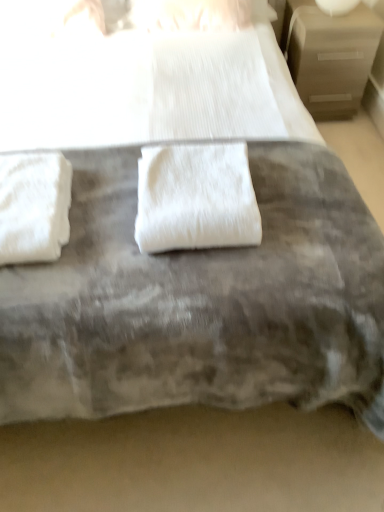
Question: Is white fluffy towel at center, which is counted as the first towel, starting from the right, thinner than white fluffy towel at left, which is the second towel from right to left?

Choices:
 (A) yes
 (B) no

Answer: (A)

Question: Is white fluffy towel at center, which is counted as the first towel, starting from the right, placed right next to white fluffy towel at left, which is the first towel from left to right?

Choices:
 (A) no
 (B) yes

Answer: (A)

Question: Does white fluffy towel at center, which is counted as the first towel, starting from the right, have a greater width compared to white fluffy towel at left, which is the second towel from right to left?

Choices:
 (A) no
 (B) yes

Answer: (A)

Question: From a real-world perspective, is white fluffy towel at center, which is counted as the first towel, starting from the right, under white fluffy towel at left, which is the first towel from left to right?

Choices:
 (A) yes
 (B) no

Answer: (B)

Question: Can you confirm if white fluffy towel at center, which ranks as the second towel in left-to-right order, is shorter than white fluffy towel at left, which is the first towel from left to right?

Choices:
 (A) yes
 (B) no

Answer: (A)

Question: In terms of size, does white fluffy towel at center, which ranks as the second towel in left-to-right order, appear bigger or smaller than white fluffy towel at left, which is the first towel from left to right?

Choices:
 (A) small
 (B) big

Answer: (B)

Question: Is white fluffy towel at center, which ranks as the second towel in left-to-right order, in front of or behind white fluffy towel at left, which is the first towel from left to right, in the image?

Choices:
 (A) behind
 (B) front

Answer: (A)

Question: Do you think white fluffy towel at center, which ranks as the second towel in left-to-right order, is within white fluffy towel at left, which is the first towel from left to right, or outside of it?

Choices:
 (A) inside
 (B) outside

Answer: (B)

Question: Based on their positions, is white fluffy towel at center, which ranks as the second towel in left-to-right order, located to the left or right of white fluffy towel at left, which is the first towel from left to right?

Choices:
 (A) left
 (B) right

Answer: (B)

Question: Which is correct: white glossy table lamp at upper right is inside white fluffy towel at left, which is the second towel from right to left, or outside of it?

Choices:
 (A) outside
 (B) inside

Answer: (A)

Question: Considering the positions of white glossy table lamp at upper right and white fluffy towel at left, which is the second towel from right to left, in the image, is white glossy table lamp at upper right wider or thinner than white fluffy towel at left, which is the second towel from right to left,?

Choices:
 (A) wide
 (B) thin

Answer: (B)

Question: Considering the positions of white glossy table lamp at upper right and white fluffy towel at left, which is the first towel from left to right, in the image, is white glossy table lamp at upper right bigger or smaller than white fluffy towel at left, which is the first towel from left to right,?

Choices:
 (A) big
 (B) small

Answer: (B)

Question: From their relative heights in the image, would you say white glossy table lamp at upper right is taller or shorter than white fluffy towel at left, which is the first towel from left to right?

Choices:
 (A) short
 (B) tall

Answer: (A)

Question: Considering the positions of white fluffy towel at center, which is counted as the first towel, starting from the right, and white glossy table lamp at upper right in the image, is white fluffy towel at center, which is counted as the first towel, starting from the right, wider or thinner than white glossy table lamp at upper right?

Choices:
 (A) thin
 (B) wide

Answer: (B)

Question: Relative to white glossy table lamp at upper right, is white fluffy towel at center, which is counted as the first towel, starting from the right, in front or behind?

Choices:
 (A) behind
 (B) front

Answer: (B)